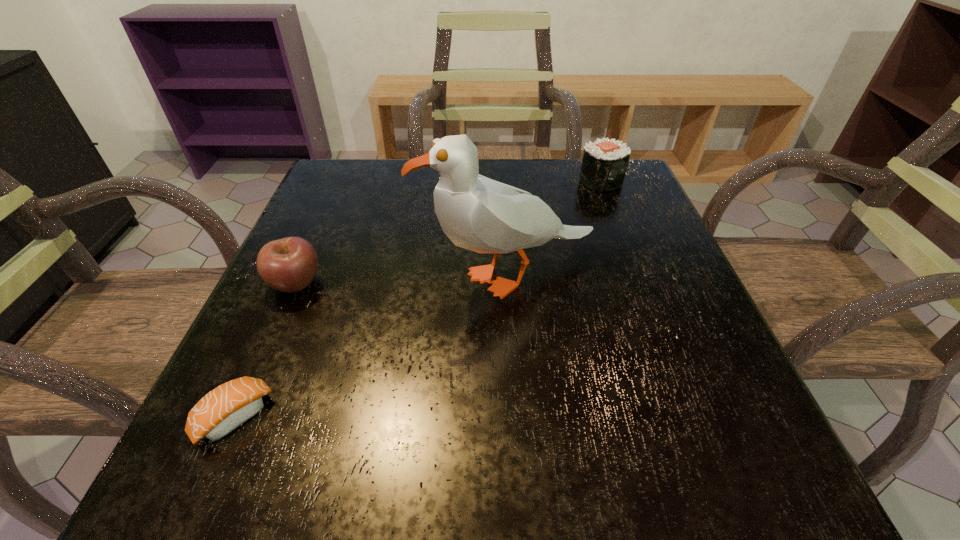
Identify the location of the tallest object. The image size is (960, 540). (477, 213).

At what (x,y) coordinates should I click in order to perform the action: click on gull. Please return your answer as a coordinate pair (x, y). The image size is (960, 540). Looking at the image, I should click on (477, 213).

Where is `the farther sushi`? the farther sushi is located at coordinates (604, 164).

Locate an element on the screen. The height and width of the screenshot is (540, 960). the right sushi is located at coordinates (604, 164).

Locate an element on the screen. Image resolution: width=960 pixels, height=540 pixels. apple is located at coordinates (289, 265).

Locate an element on the screen. the shortest object is located at coordinates (228, 406).

Locate an element on the screen. This screenshot has height=540, width=960. the shorter sushi is located at coordinates (228, 406).

Locate an element on the screen. This screenshot has width=960, height=540. blank area located 0.180m at the beak of the second object from right to left is located at coordinates (324, 278).

Image resolution: width=960 pixels, height=540 pixels. I want to click on free space located 0.080m at the beak of the second object from right to left, so click(x=379, y=278).

The height and width of the screenshot is (540, 960). In order to click on free space located at the beak of the second object from right to left in this screenshot , I will do `click(269, 278)`.